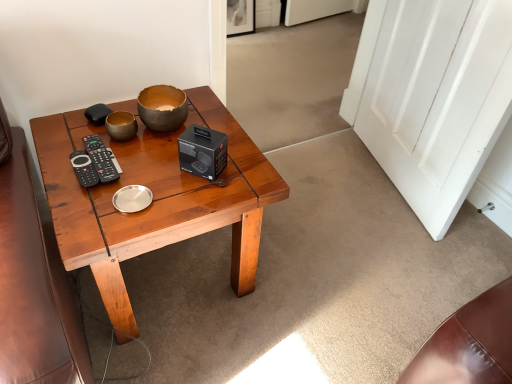
This screenshot has width=512, height=384. In order to click on vacant space situated above wooden coffee table at center (from a real-world perspective) in this screenshot , I will do `click(136, 177)`.